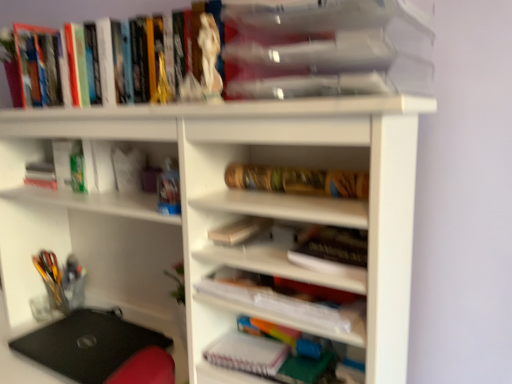
Question: Is clear plastic container at upper center, which is counted as the fifth book, starting from the bottom, wider or thinner than hardcover books at upper left, marked as the 1th book in a top-to-bottom arrangement?

Choices:
 (A) thin
 (B) wide

Answer: (B)

Question: Considering the positions of clear plastic container at upper center, which is counted as the fifth book, starting from the bottom, and hardcover books at upper left, which ranks as the sixth book in bottom-to-top order, in the image, is clear plastic container at upper center, which is counted as the fifth book, starting from the bottom, taller or shorter than hardcover books at upper left, which ranks as the sixth book in bottom-to-top order,?

Choices:
 (A) short
 (B) tall

Answer: (A)

Question: Which of these objects is positioned closest to the matte white book at center, marked as the fourth book in a top-to-bottom arrangement?

Choices:
 (A) clear plastic container at upper center, marked as the second book in a top-to-bottom arrangement
 (B) hardcover books at upper left, marked as the 1th book in a top-to-bottom arrangement
 (C) white paper notebook at center, acting as the sixth book starting from the top
 (D) black matte laptop at lower left
 (E) wooden notebook at center-right, arranged as the 5th book when viewed from the top

Answer: (C)

Question: Estimate the real-world distances between objects in this image. Which object is farther from the wooden notebook at center-right, placed as the second book when sorted from bottom to top?

Choices:
 (A) white paper notebook at center, the first book positioned from the bottom
 (B) hardcover books at upper left, which ranks as the sixth book in bottom-to-top order
 (C) gold textured tube at center, which appears as the 4th book when ordered from the bottom
 (D) white matte notebook at lower center
 (E) black matte laptop at lower left

Answer: (B)